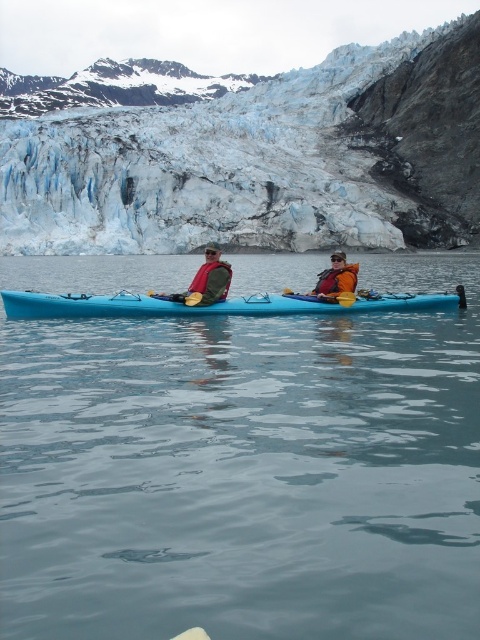
From the picture: You are a photographer planning to capture the kayakers and the glacier in one shot. Given the clear water at center and the yellow plastic paddle at center, which object should you focus on first to ensure both are in frame?

The clear water at center has a larger width than the yellow plastic paddle at center, so focusing on the clear water at center first will ensure both objects are within the frame.

You are a photographer trying to capture a clear shot of both the matte green jacket at center and the yellow plastic paddle at center. Since you want both items in focus, you need to adjust your camera settings. Which object should you focus on first to ensure both are sharp?

You should focus on the matte green jacket at center first because it is closer to the viewer than the yellow plastic paddle at center. By focusing on the closer object, the farther object will also be in focus due to the depth of field.

You are a photographer trying to capture the kayakers and the glacier. You notice the clear water at center and the orange fleece jacket at center. Which object is positioned closer to your camera lens?

The clear water at center is closer to the viewer than the orange fleece jacket at center, so the clear water at center would be closer to the camera lens.